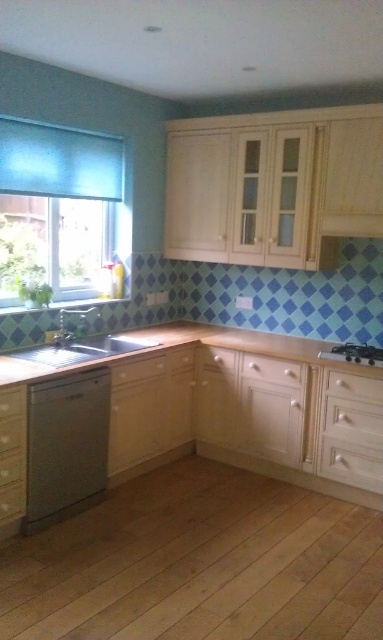
Is wooden countertop at lower center taller than satin silver sink at lower left?

Incorrect, wooden countertop at lower center's height is not larger of satin silver sink at lower left's.

Based on the photo, is wooden countertop at lower center shorter than satin silver sink at lower left?

Yes.

Which is in front, point (194, 324) or point (68, 342)?

Point (68, 342) is more forward.

I want to click on wooden countertop at lower center, so click(183, 346).

Does point (70, 342) lie behind point (248, 355)?

That is False.

Which is in front, point (88, 328) or point (248, 371)?

Positioned in front is point (248, 371).

You are a GUI agent. You are given a task and a screenshot of the screen. Output one action in this format:
    pyautogui.click(x=<x>, y=<y>)
    Task: Click on the satin silver sink at lower left
    This screenshot has width=383, height=640.
    Given the screenshot: What is the action you would take?
    pyautogui.click(x=78, y=342)

Is point (24, 376) less distant than point (122, 376)?

Yes, point (24, 376) is in front of point (122, 376).

Identify the location of wooden countertop at lower center. (183, 346).

I want to click on wooden countertop at lower center, so click(183, 346).